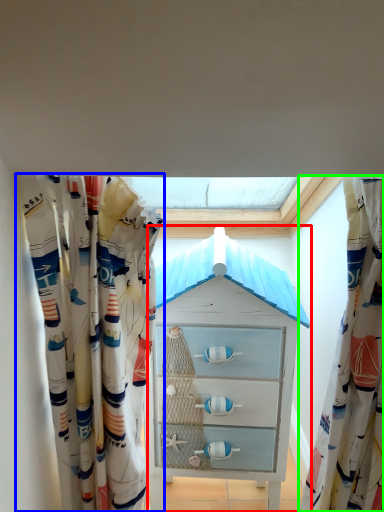
Question: Which is nearer to the chest of drawers (highlighted by a red box)? curtain (highlighted by a blue box) or curtain (highlighted by a green box).

Choices:
 (A) curtain
 (B) curtain

Answer: (A)